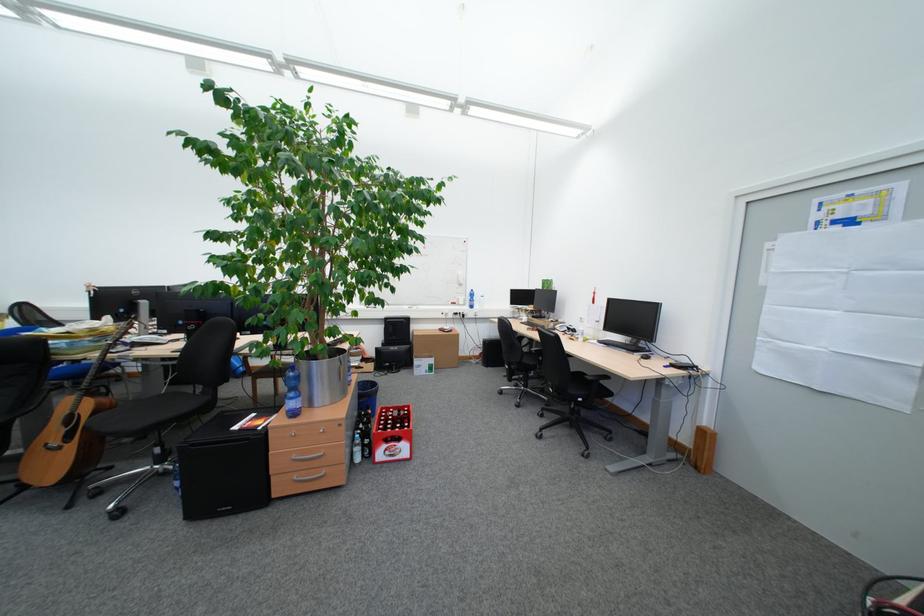
Where is `silver drawer handle`? The height and width of the screenshot is (616, 924). silver drawer handle is located at coordinates (309, 477).